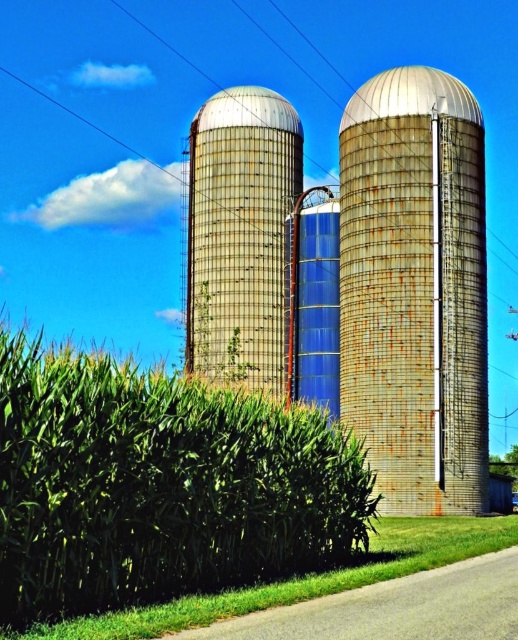
Can you confirm if rusty metal silo at center is thinner than rusty metallic silo at center?

Yes, rusty metal silo at center is thinner than rusty metallic silo at center.

From the picture: Who is positioned more to the right, rusty metal silo at center or rusty metallic silo at center?

rusty metal silo at center

Is point (383, 188) less distant than point (240, 177)?

Yes.

This screenshot has width=518, height=640. I want to click on rusty metal silo at center, so click(x=414, y=289).

Is point (46, 385) closer to camera compared to point (448, 390)?

Yes, point (46, 385) is in front of point (448, 390).

Describe the element at coordinates (159, 484) in the screenshot. Image resolution: width=518 pixels, height=640 pixels. I see `green leafy corn at center` at that location.

The image size is (518, 640). I want to click on green leafy corn at center, so click(159, 484).

Can you confirm if green leafy corn at center is positioned to the right of rusty metallic silo at center?

Yes, green leafy corn at center is to the right of rusty metallic silo at center.

Between green leafy corn at center and rusty metallic silo at center, which one appears on the right side from the viewer's perspective?

green leafy corn at center

You are a GUI agent. You are given a task and a screenshot of the screen. Output one action in this format:
    pyautogui.click(x=<x>, y=<y>)
    Task: Click on the green leafy corn at center
    The image size is (518, 640).
    Given the screenshot: What is the action you would take?
    pyautogui.click(x=159, y=484)